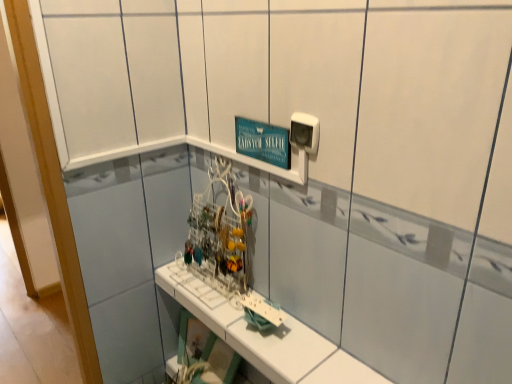
The width and height of the screenshot is (512, 384). Find the location of `vacant area on top of white plastic shelf at center (from a real-world perspective)`. vacant area on top of white plastic shelf at center (from a real-world perspective) is located at coordinates (248, 321).